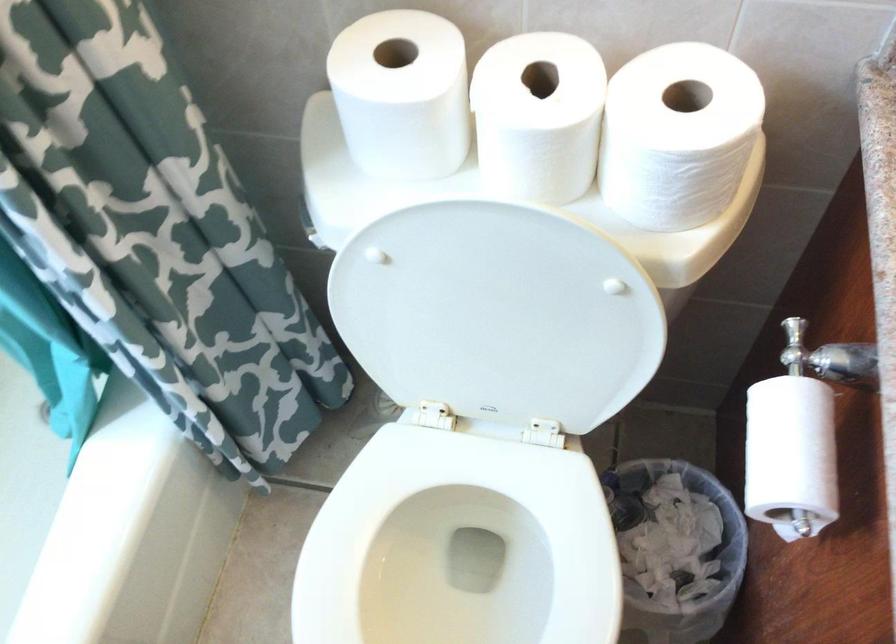
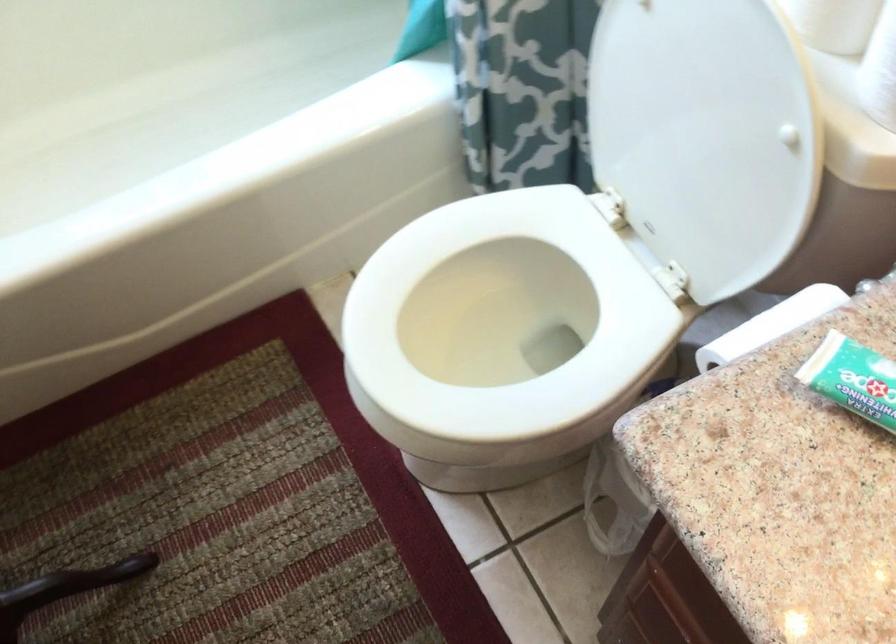
In the second image, find the point that corresponds to point 642,200 in the first image.

(880, 70)